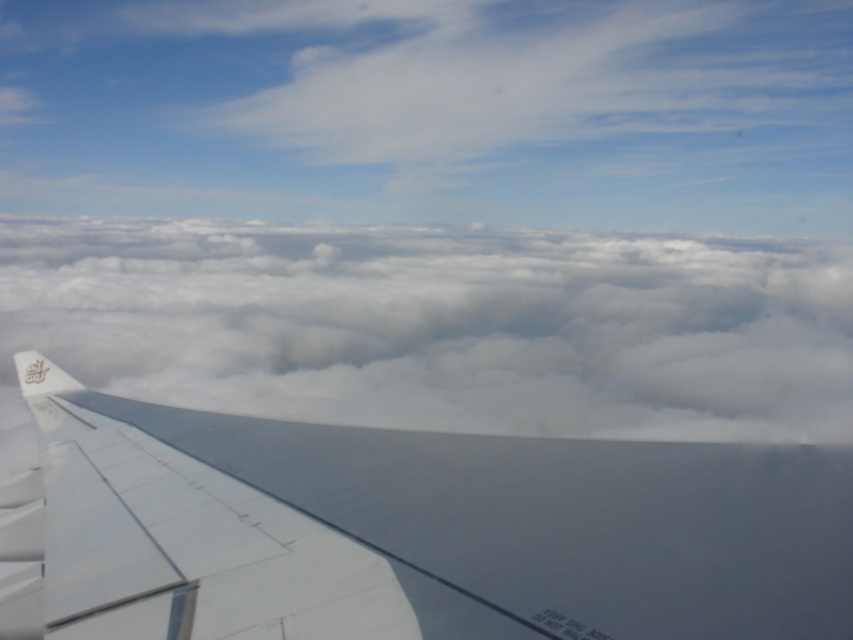
Question: Among these objects, which one is nearest to the camera?

Choices:
 (A) white matte wing at center
 (B) white fluffy cloud at center

Answer: (A)

Question: Does white matte wing at center appear under white fluffy cloud at center?

Choices:
 (A) no
 (B) yes

Answer: (B)

Question: Can you confirm if white matte wing at center is positioned to the left of white fluffy cloud at center?

Choices:
 (A) yes
 (B) no

Answer: (B)

Question: Is white matte wing at center smaller than white fluffy cloud at center?

Choices:
 (A) yes
 (B) no

Answer: (A)